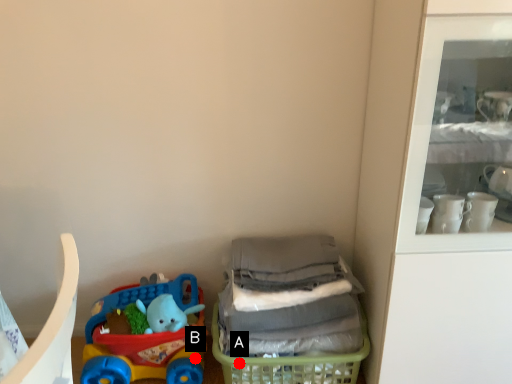
Question: Two points are circled on the image, labeled by A and B beside each circle. Among these points, which one is farthest from the camera?

Choices:
 (A) A is further
 (B) B is further

Answer: (B)